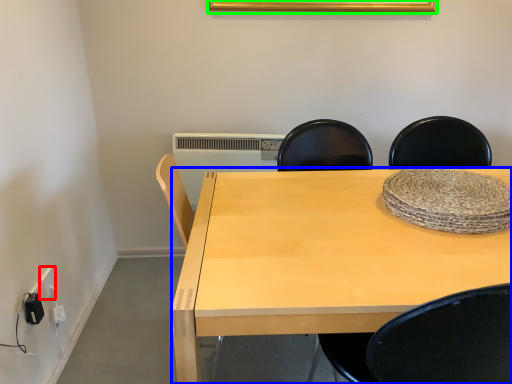
Question: Which object is positioned closest to electric outlet (highlighted by a red box)? Select from desk (highlighted by a blue box) and picture frame (highlighted by a green box).

Choices:
 (A) desk
 (B) picture frame

Answer: (A)